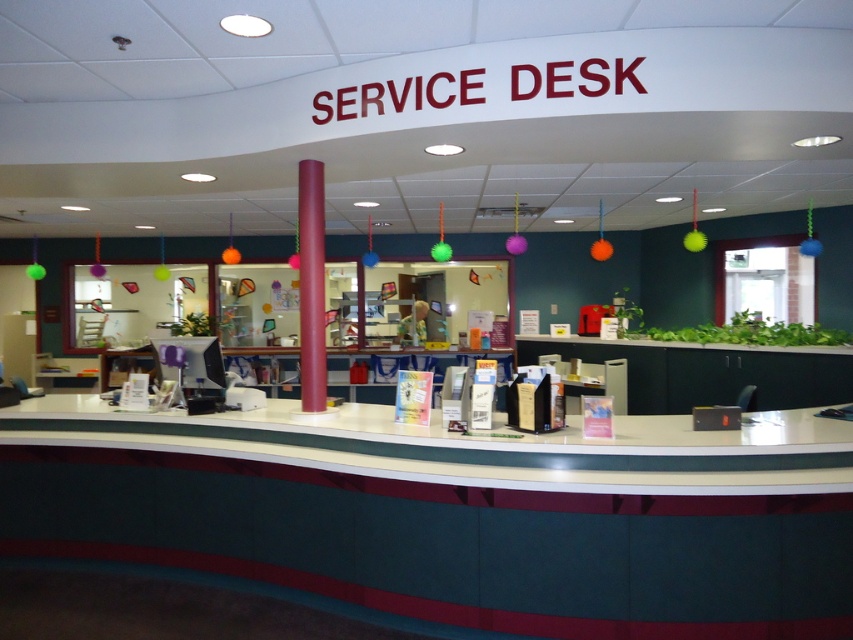
Is green laminate desk at center shorter than matte plastic information desk at center?

No, green laminate desk at center is not shorter than matte plastic information desk at center.

How much distance is there between green laminate desk at center and matte plastic information desk at center?

green laminate desk at center is 16.66 feet from matte plastic information desk at center.

Is point (270, 461) farther from viewer compared to point (279, 387)?

No, it is in front of (279, 387).

I want to click on green laminate desk at center, so click(x=457, y=515).